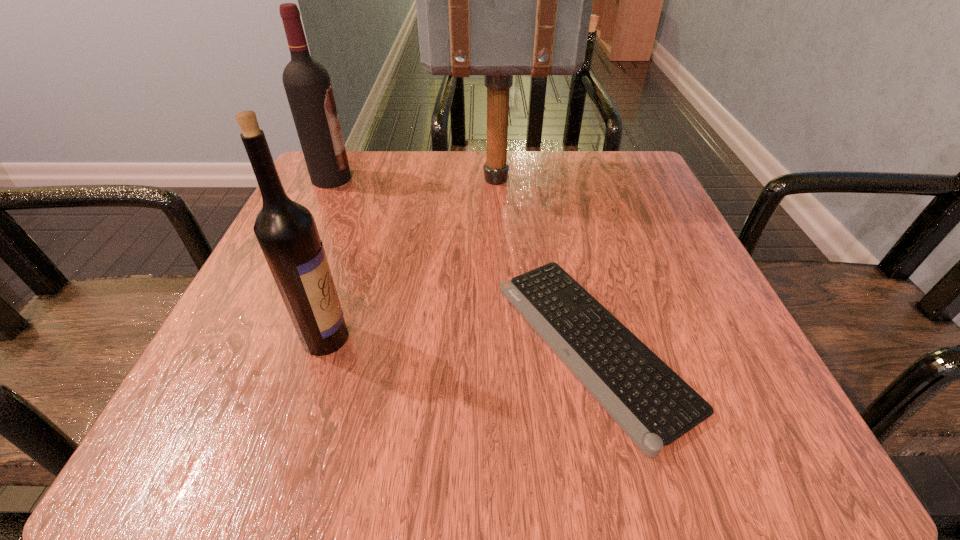
Image resolution: width=960 pixels, height=540 pixels. In order to click on mallet in this screenshot , I will do `click(498, 0)`.

The width and height of the screenshot is (960, 540). Identify the location of the farther wine bottle. (307, 84).

The height and width of the screenshot is (540, 960). I want to click on the leftmost object, so click(307, 84).

Where is `the nearer wine bottle`? The width and height of the screenshot is (960, 540). the nearer wine bottle is located at coordinates coord(286,231).

Locate an element on the screen. The height and width of the screenshot is (540, 960). the right wine bottle is located at coordinates (286, 231).

At what (x,y) coordinates should I click in order to perform the action: click on computer keyboard. Please return your answer as a coordinate pair (x, y). Looking at the image, I should click on (654, 406).

Locate an element on the screen. vacant area situated on the striking surface of the tallest object is located at coordinates (326, 179).

This screenshot has width=960, height=540. Identify the location of vacant space located on the striking surface of the tallest object. (369, 179).

Identify the location of free region located on the striking surface of the tallest object. (393, 179).

This screenshot has width=960, height=540. I want to click on free spot located 0.150m on the label of the farther wine bottle, so click(x=421, y=179).